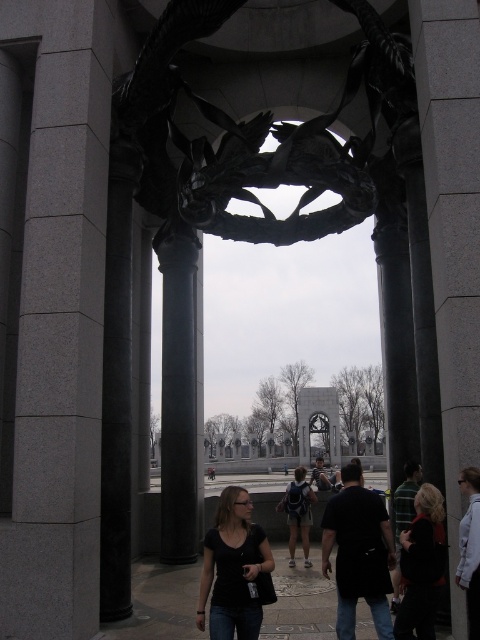
You are a photographer standing at the memorial site. You need to capture a photo that includes both the gray stone pillar at center and the black fabric jacket at lower right. Given their sizes, which object will appear larger in the photo?

The gray stone pillar at center will appear larger in the photo because it has a greater height compared to the black fabric jacket at lower right.